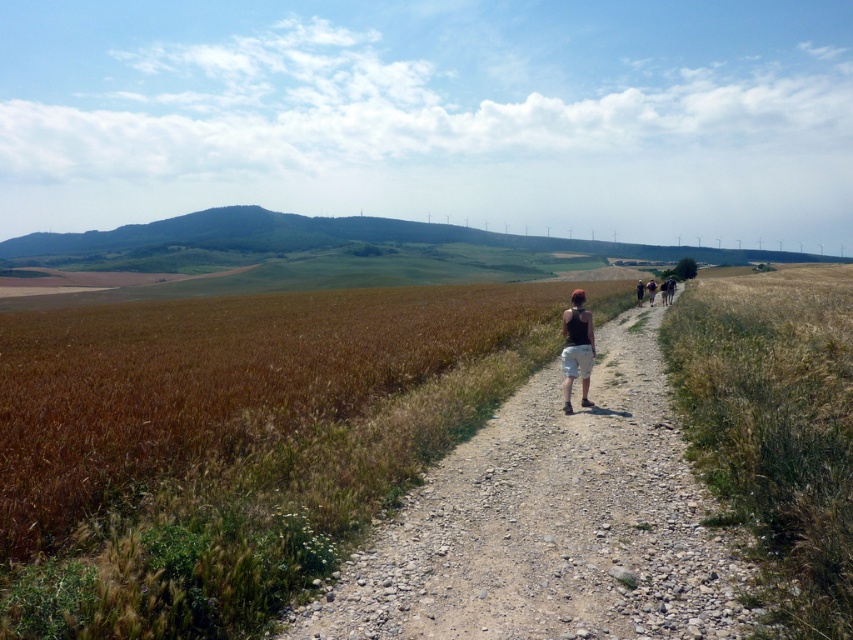
You are standing on the narrow, unpaved path in the foreground of the scene and want to cross to the brown grassy field at center. The path is 3 feet wide. Can you safely walk across the gap between them?

The gap between the narrow, unpaved path and the brown grassy field at center is 13.74 feet. Since the path is only 3 feet wide, the gap is too wide to safely cross. You should find another route or wait for assistance.

From the picture: You are a photographer trying to capture a landscape photo. You notice the brown grassy field at center and the matte black tank top at center in your frame. Which object will appear taller in the photo?

The brown grassy field at center will appear taller in the photo because it has a greater height compared to the matte black tank top at center.